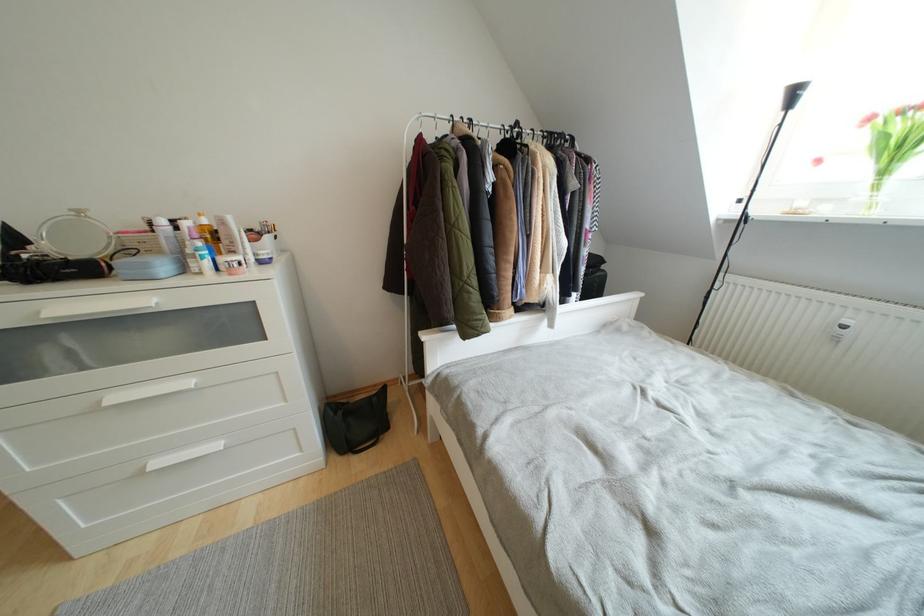
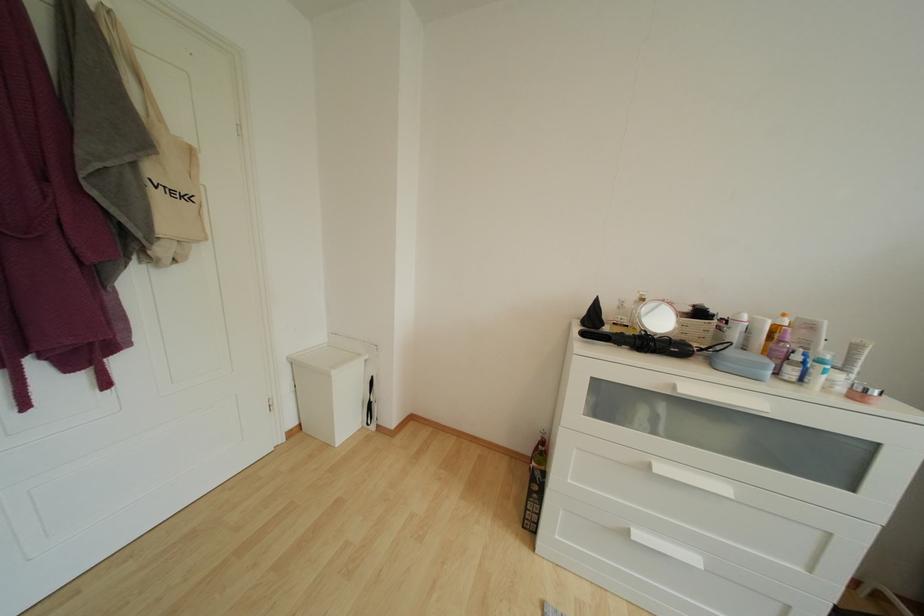
Where in the second image is the point corresponding to point 110,408 from the first image?

(660, 475)